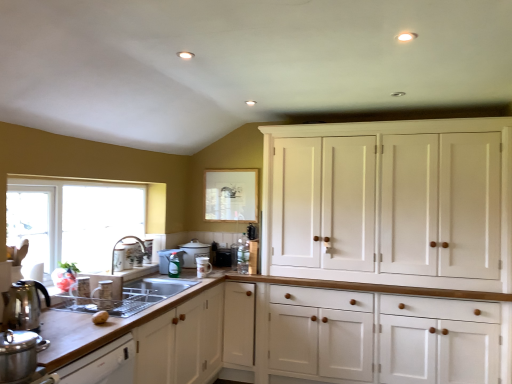
Identify the location of vacant space that's between matte white cup at sink, which is the 5th appliance in back-to-front order, and shiny metallic kettle at left. This screenshot has width=512, height=384. (67, 314).